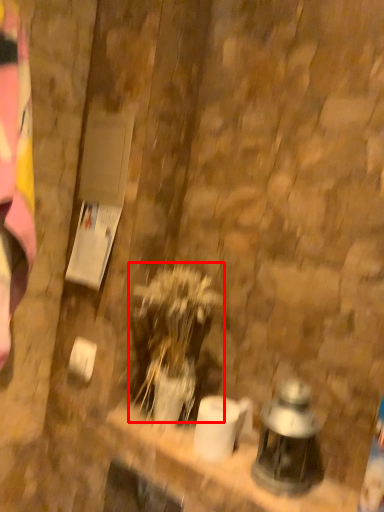
Question: From the image's perspective, where is plant (annotated by the red box) located relative to lantern?

Choices:
 (A) above
 (B) below

Answer: (A)